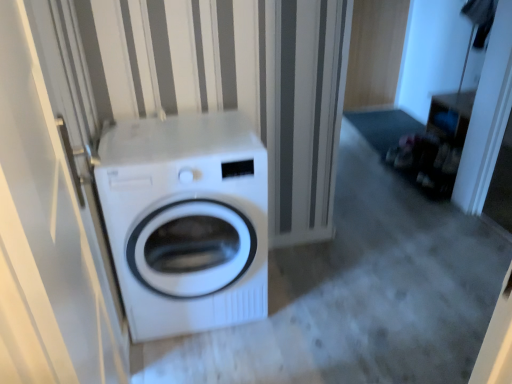
The image size is (512, 384). I want to click on free location in front of white glossy washing machine at center, so click(210, 358).